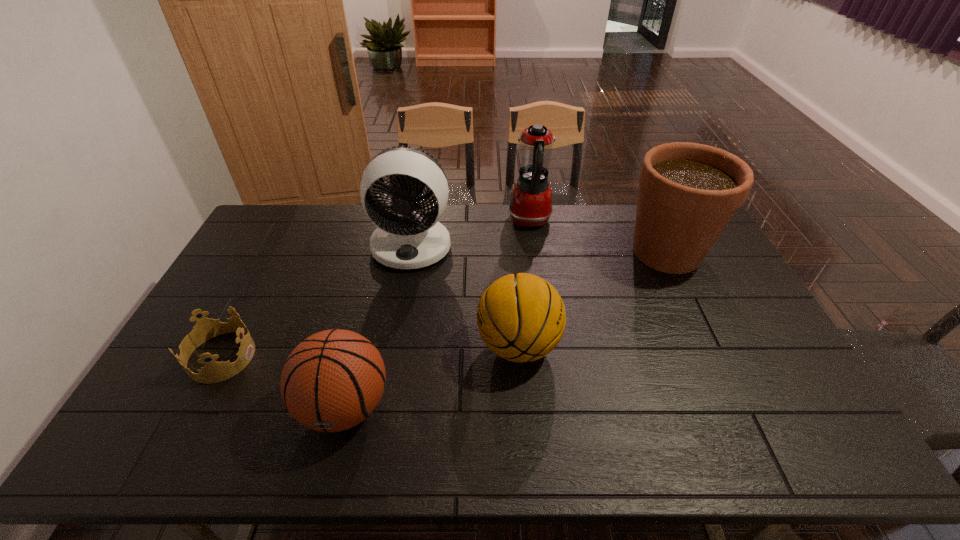
I want to click on free location that satisfies the following two spatial constraints: 1. on the controls of the food processor; 2. on the grille of the fan, so click(534, 246).